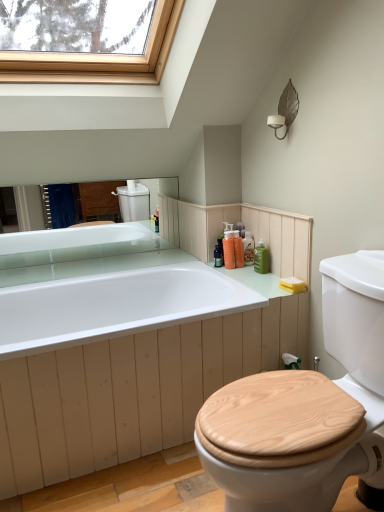
What are the coordinates of `free space in front of translucent plastic bottles at upper right, the first toiletry from the left` in the screenshot? It's located at pos(249,270).